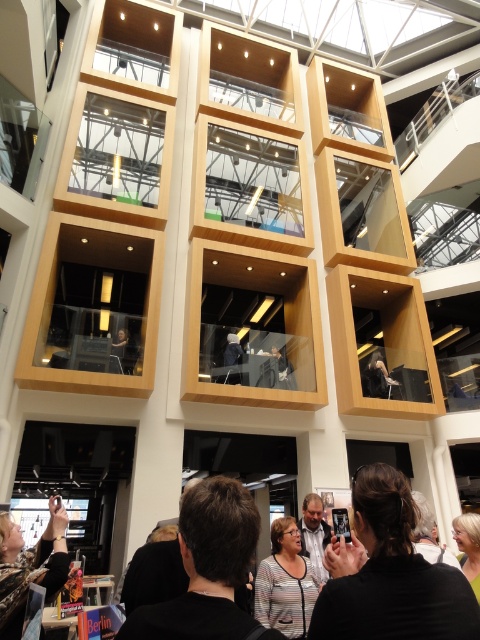
Question: Is dark brown hair at center positioned behind gray striped shirt at center?

Choices:
 (A) yes
 (B) no

Answer: (B)

Question: Among these objects, which one is farthest from the camera?

Choices:
 (A) gray striped shirt at center
 (B) dark brown hair at lower center

Answer: (A)

Question: Can you confirm if dark brown hair at center is wider than black leather jacket at lower left?

Choices:
 (A) yes
 (B) no

Answer: (A)

Question: Which of these objects is positioned closest to the gray striped shirt at center?

Choices:
 (A) striped fabric shirt at center
 (B) black leather jacket at lower left

Answer: (A)

Question: Considering the real-world distances, which object is closest to the striped fabric shirt at center?

Choices:
 (A) dark brown hair at lower center
 (B) dark brown hair at center

Answer: (A)

Question: Can you confirm if dark brown hair at center is positioned above gray striped shirt at center?

Choices:
 (A) yes
 (B) no

Answer: (A)